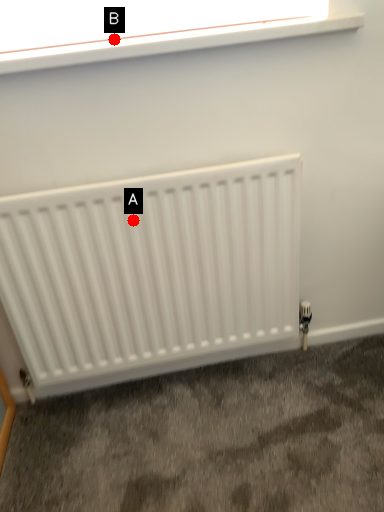
Question: Two points are circled on the image, labeled by A and B beside each circle. Which point appears closest to the camera in this image?

Choices:
 (A) A is closer
 (B) B is closer

Answer: (B)